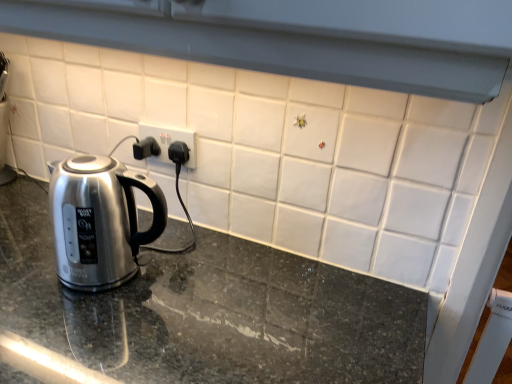
Find the location of a particular element. free region under satin metallic kettle at left (from a real-world perspective) is located at coordinates (105, 285).